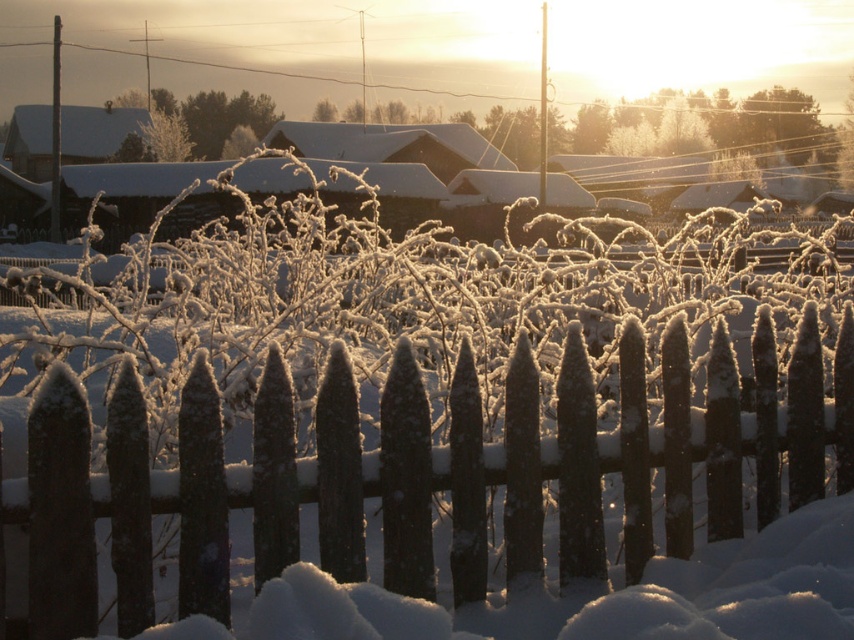
You are a painter who wants to capture the scene in front of you. You have a canvas that can only fit objects up to the width of the matte brown wooden hut at upper left. Can you fit the smooth dark wood fence at center on your canvas?

The smooth dark wood fence at center is narrower than the matte brown wooden hut at upper left, so yes, the smooth dark wood fence at center can fit on the canvas since its width is smaller than the maximum allowed width.